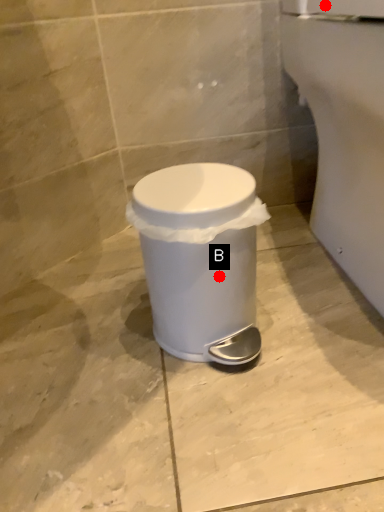
Question: Two points are circled on the image, labeled by A and B beside each circle. Which point is closer to the camera?

Choices:
 (A) A is closer
 (B) B is closer

Answer: (B)